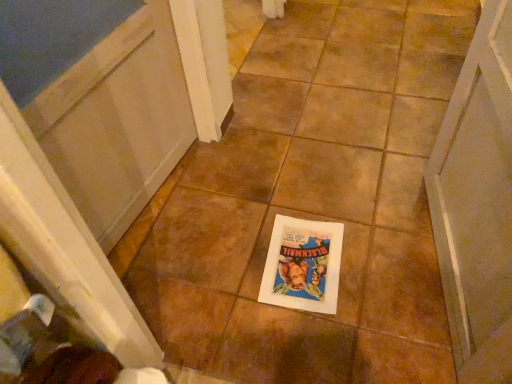
Locate an element on the screen. The width and height of the screenshot is (512, 384). vacant space behind matte paper book at center is located at coordinates (292, 203).